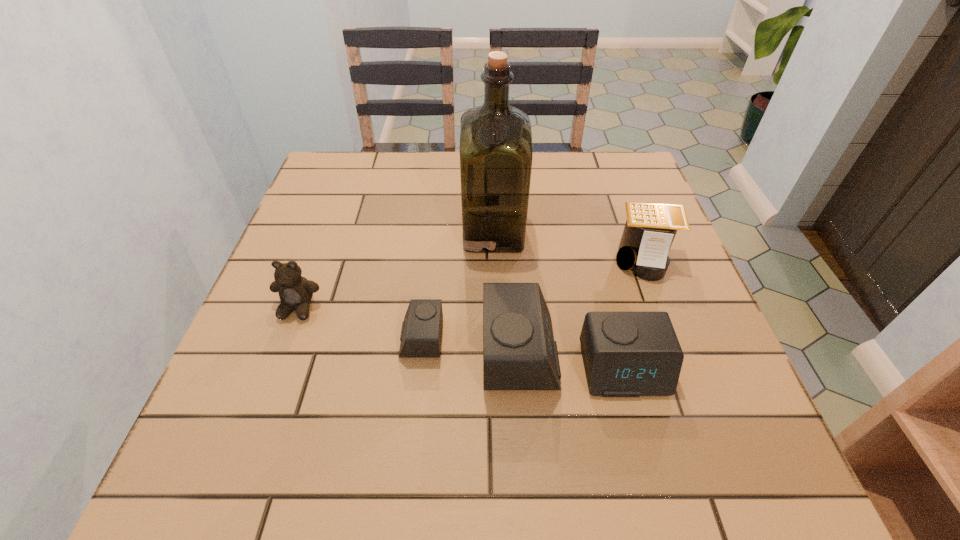
Where is `vacant space that satisfies the following two spatial constraints: 1. on the front side of the calculator; 2. on the front-facing side of the second alarm clock from right to left`? The width and height of the screenshot is (960, 540). vacant space that satisfies the following two spatial constraints: 1. on the front side of the calculator; 2. on the front-facing side of the second alarm clock from right to left is located at coordinates (680, 353).